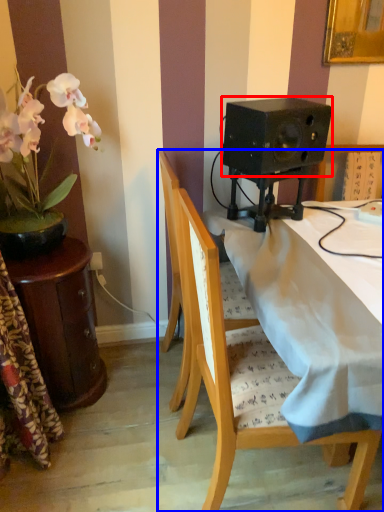
Question: Which of the following is the closest to the observer, speaker (highlighted by a red box) or chair (highlighted by a blue box)?

Choices:
 (A) speaker
 (B) chair

Answer: (B)